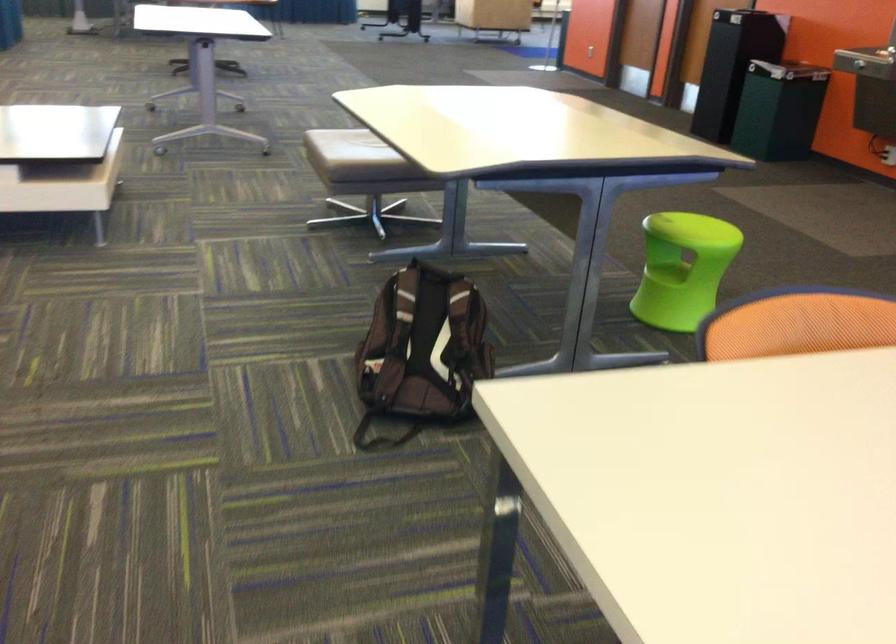
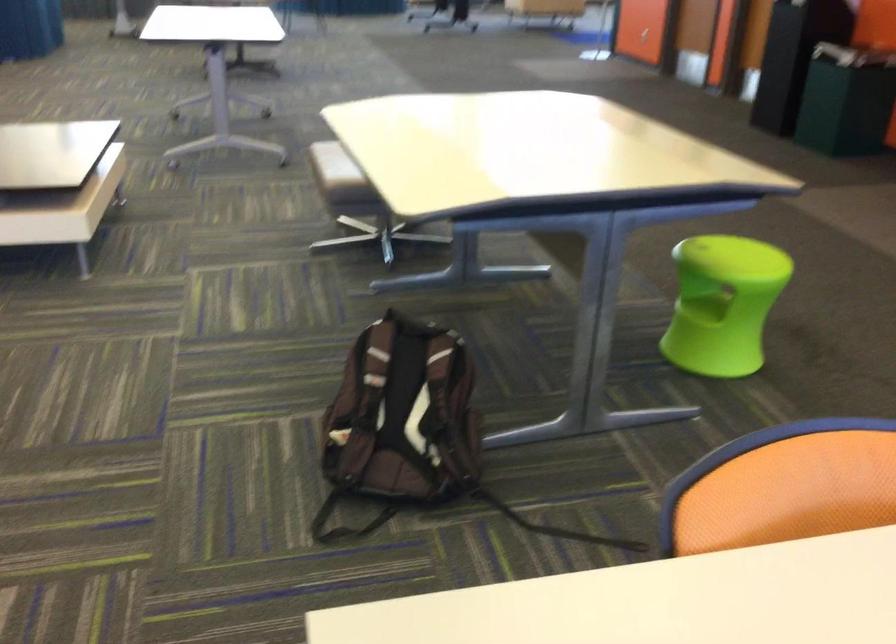
The point at [685,223] is marked in the first image. Where is the corresponding point in the second image?

(730, 247)